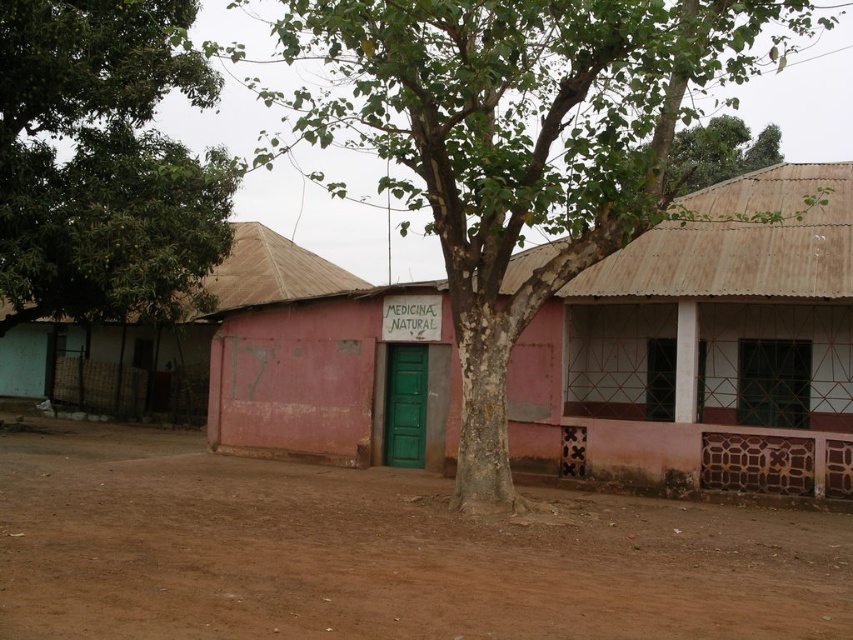
Question: Estimate the real-world distances between objects in this image. Which object is farther from the green leafy tree at center?

Choices:
 (A) brown dirt field at lower center
 (B) green bark tree at center

Answer: (B)

Question: Which of the following is the farthest from the observer?

Choices:
 (A) green bark tree at center
 (B) green leafy tree at center
 (C) brown dirt field at lower center

Answer: (B)

Question: Where is brown dirt field at lower center located in relation to pink matte building at center in the image?

Choices:
 (A) below
 (B) above

Answer: (A)

Question: Can you confirm if brown dirt field at lower center is positioned above pink matte building at center?

Choices:
 (A) no
 (B) yes

Answer: (A)

Question: Can you confirm if green leafy tree at center is smaller than pink matte building at center?

Choices:
 (A) yes
 (B) no

Answer: (A)

Question: Which of the following is the farthest from the observer?

Choices:
 (A) green bark tree at center
 (B) brown dirt field at lower center
 (C) pink matte building at center
 (D) green leafy tree at center

Answer: (D)